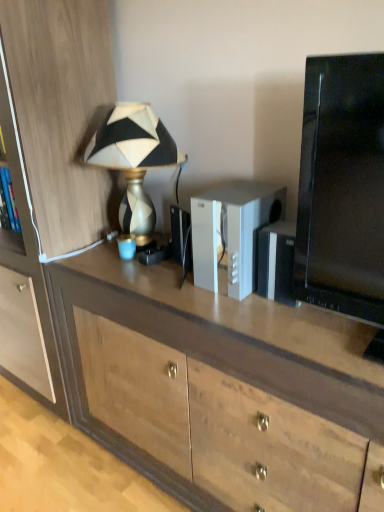
Question: Considering the relative positions of wooden cabinet at left and white plastic speaker at center in the image provided, is wooden cabinet at left to the left of white plastic speaker at center from the viewer's perspective?

Choices:
 (A) no
 (B) yes

Answer: (B)

Question: Can you confirm if wooden cabinet at left is smaller than white plastic speaker at center?

Choices:
 (A) yes
 (B) no

Answer: (B)

Question: From a real-world perspective, is wooden cabinet at left below white plastic speaker at center?

Choices:
 (A) yes
 (B) no

Answer: (A)

Question: Can you confirm if wooden cabinet at left is thinner than white plastic speaker at center?

Choices:
 (A) yes
 (B) no

Answer: (B)

Question: Is the position of wooden cabinet at left less distant than that of white plastic speaker at center?

Choices:
 (A) no
 (B) yes

Answer: (A)

Question: From a real-world perspective, is wooden cabinet at left on white plastic speaker at center?

Choices:
 (A) no
 (B) yes

Answer: (A)

Question: Is wooden desk at center to the left of white plastic speaker at center from the viewer's perspective?

Choices:
 (A) no
 (B) yes

Answer: (B)

Question: From the image's perspective, is wooden desk at center located above white plastic speaker at center?

Choices:
 (A) no
 (B) yes

Answer: (A)

Question: Is white plastic speaker at center at the back of wooden desk at center?

Choices:
 (A) yes
 (B) no

Answer: (B)

Question: Can you confirm if wooden desk at center is positioned to the right of white plastic speaker at center?

Choices:
 (A) no
 (B) yes

Answer: (A)

Question: From a real-world perspective, is wooden desk at center over white plastic speaker at center?

Choices:
 (A) yes
 (B) no

Answer: (B)

Question: Can you confirm if wooden desk at center is wider than white plastic speaker at center?

Choices:
 (A) no
 (B) yes

Answer: (B)

Question: Is white plastic speaker at center smaller than wooden cabinet at left?

Choices:
 (A) no
 (B) yes

Answer: (B)